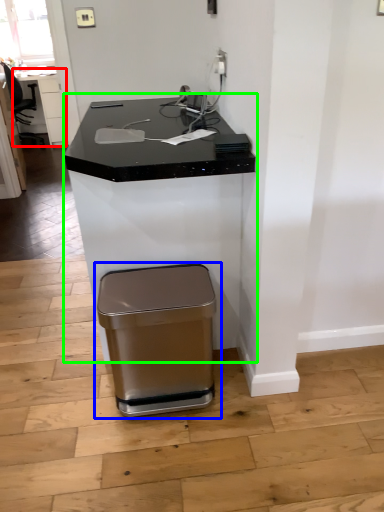
Question: Which object is positioned closest to table (highlighted by a red box)? Select from waste container (highlighted by a blue box) and desk (highlighted by a green box).

Choices:
 (A) waste container
 (B) desk

Answer: (B)